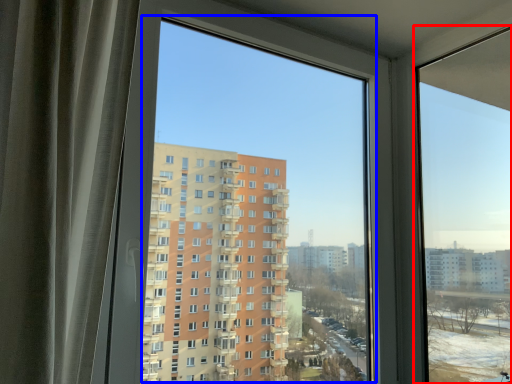
Question: Which object appears closest to the camera in this image, window (highlighted by a red box) or window screen (highlighted by a blue box)?

Choices:
 (A) window
 (B) window screen

Answer: (B)